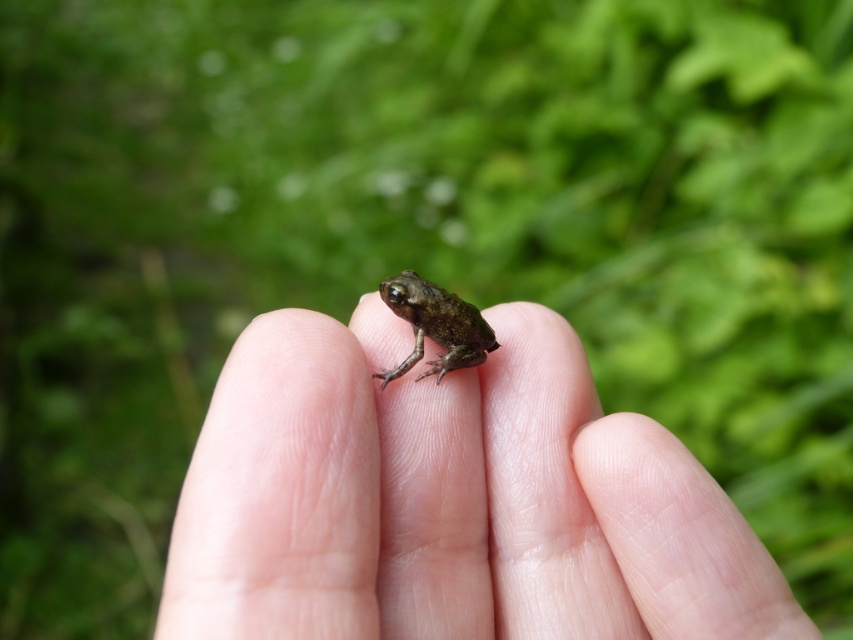
Question: Can you confirm if smooth skin palm at center is positioned to the left of green matte frog at center?

Choices:
 (A) yes
 (B) no

Answer: (B)

Question: Is smooth skin palm at center smaller than green matte frog at center?

Choices:
 (A) no
 (B) yes

Answer: (A)

Question: Can you confirm if smooth skin palm at center is wider than green matte frog at center?

Choices:
 (A) no
 (B) yes

Answer: (B)

Question: Which of the following is the closest to the observer?

Choices:
 (A) (479, 336)
 (B) (445, 618)

Answer: (B)

Question: Among these points, which one is farthest from the camera?

Choices:
 (A) (447, 300)
 (B) (514, 340)

Answer: (B)